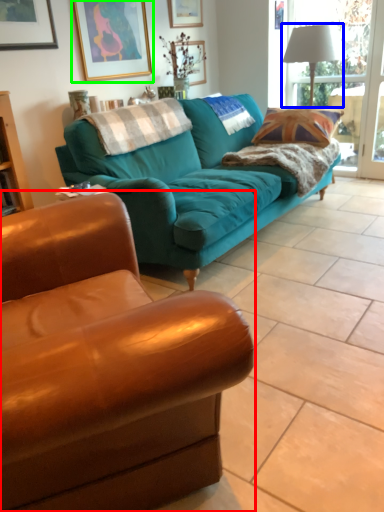
Question: Considering the real-world distances, which object is closest to studio couch (highlighted by a red box)? lamp (highlighted by a blue box) or picture frame (highlighted by a green box).

Choices:
 (A) lamp
 (B) picture frame

Answer: (B)